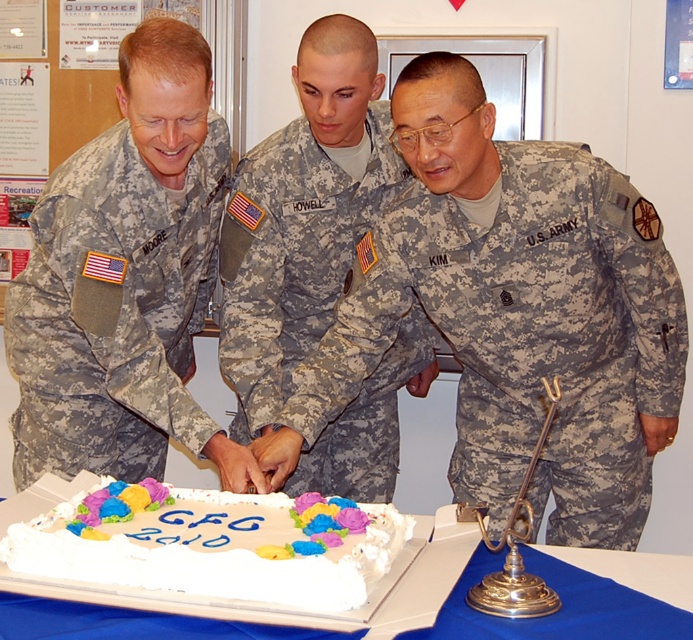
You are a photographer trying to capture a photo of the camouflage fabric us army uniform at center and the white frosted rectangular cake at lower center. Since you want both subjects to appear equally prominent in the photo, which one should you zoom in on more?

The camouflage fabric us army uniform at center is larger in size than the white frosted rectangular cake at lower center. To make both appear equally prominent, you should zoom in more on the white frosted rectangular cake at lower center to compensate for its smaller size.

From the picture: You are standing in the room where the scene is taking place. You need to find the camouflage fabric us army uniform at center. Based on its coordinates, is it closer to the top or bottom of the image?

The camouflage fabric us army uniform at center is located at point (526, 337). Since the y coordinate is 0.760, which is closer to 1.0, it is closer to the bottom of the image.

You are an observer standing in front of the cake. Which of the two individuals wearing camouflage fabric uniform at left and camouflage fabric uniform at center is shorter?

The camouflage fabric uniform at left is shorter than the camouflage fabric uniform at center.